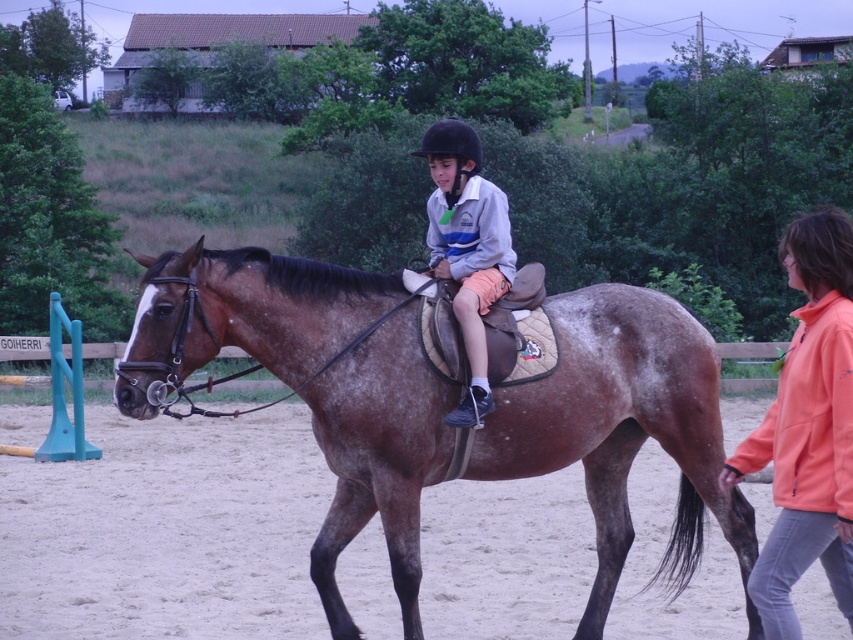
Does brown speckled saddle at center appear under matte gray jacket at center?

Correct, brown speckled saddle at center is located below matte gray jacket at center.

Can you confirm if brown speckled saddle at center is smaller than matte gray jacket at center?

Incorrect, brown speckled saddle at center is not smaller in size than matte gray jacket at center.

Locate an element on the screen. This screenshot has width=853, height=640. brown speckled saddle at center is located at coordinates (622, 428).

Does orange fleece jacket at right come in front of matte gray jacket at center?

Yes.

How distant is orange fleece jacket at right from matte gray jacket at center?

The distance of orange fleece jacket at right from matte gray jacket at center is 1.57 meters.

At what (x,y) coordinates should I click in order to perform the action: click on orange fleece jacket at right. Please return your answer as a coordinate pair (x, y). Looking at the image, I should click on (807, 428).

The width and height of the screenshot is (853, 640). Identify the location of orange fleece jacket at right. (807, 428).

The width and height of the screenshot is (853, 640). What do you see at coordinates (622, 428) in the screenshot?
I see `brown speckled saddle at center` at bounding box center [622, 428].

Is brown speckled saddle at center positioned at the back of orange fleece jacket at right?

Yes, it is behind orange fleece jacket at right.

This screenshot has height=640, width=853. What do you see at coordinates (622, 428) in the screenshot?
I see `brown speckled saddle at center` at bounding box center [622, 428].

Identify the location of brown speckled saddle at center. This screenshot has height=640, width=853. (622, 428).